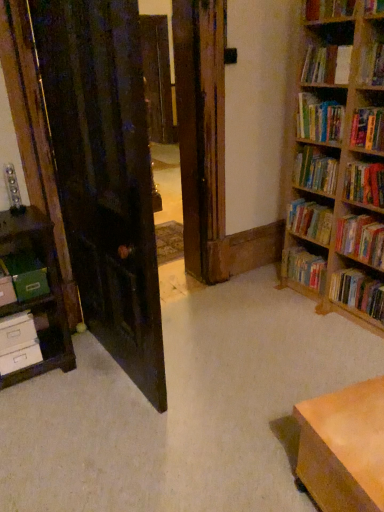
The image size is (384, 512). What do you see at coordinates (105, 175) in the screenshot?
I see `dark wood door at left` at bounding box center [105, 175].

The image size is (384, 512). What do you see at coordinates (327, 65) in the screenshot?
I see `hardcover book at upper right, the 8th book when ordered from bottom to top` at bounding box center [327, 65].

Locate an element on the screen. hardcover books at right, which ranks as the 4th book in bottom-to-top order is located at coordinates 310,221.

Describe the element at coordinates (319, 119) in the screenshot. Image resolution: width=384 pixels, height=512 pixels. I see `hardcover books at upper right, the 3th book in the top-to-bottom sequence` at that location.

Find the location of a particular element. The height and width of the screenshot is (512, 384). white cardboard drawer at lower left, placed as the 1th drawer when sorted from top to bottom is located at coordinates (17, 333).

What do you see at coordinates (328, 9) in the screenshot? I see `hardcover book at upper right, the 1th book when ordered from top to bottom` at bounding box center [328, 9].

Identify the location of white matte drawer at lower left, marked as the first drawer in a bottom-to-top arrangement. (20, 358).

Find the location of a particular element. dark wood door at left is located at coordinates [105, 175].

How much distance is there between hardcover book at lower right, the eighth book when ordered from top to bottom, and hardcover books at upper right, the 3th book in the top-to-bottom sequence?

A distance of 86.17 centimeters exists between hardcover book at lower right, the eighth book when ordered from top to bottom, and hardcover books at upper right, the 3th book in the top-to-bottom sequence.

Considering the sizes of objects hardcover book at lower right, the eighth book when ordered from top to bottom, and hardcover books at upper right, acting as the seventh book starting from the bottom, in the image provided, who is shorter, hardcover book at lower right, the eighth book when ordered from top to bottom, or hardcover books at upper right, acting as the seventh book starting from the bottom,?

With less height is hardcover book at lower right, the eighth book when ordered from top to bottom.

Between hardcover book at lower right, the eighth book when ordered from top to bottom, and hardcover books at upper right, the 3th book in the top-to-bottom sequence, which one appears on the left side from the viewer's perspective?

hardcover books at upper right, the 3th book in the top-to-bottom sequence, is more to the left.

Is hardcover book at lower right, the 2th book ordered from the bottom, not close to hardcover books at upper right, acting as the seventh book starting from the bottom?

hardcover book at lower right, the 2th book ordered from the bottom, is near hardcover books at upper right, acting as the seventh book starting from the bottom, not far away.

Looking at this image, is hardcover books at upper right, the 3th book in the top-to-bottom sequence, positioned with its back to white matte drawer at lower left, the second drawer from the top?

That's not correct — hardcover books at upper right, the 3th book in the top-to-bottom sequence, is not looking away from white matte drawer at lower left, the second drawer from the top.

Considering the positions of objects hardcover books at upper right, acting as the seventh book starting from the bottom, and white matte drawer at lower left, marked as the first drawer in a bottom-to-top arrangement, in the image provided, who is more to the right, hardcover books at upper right, acting as the seventh book starting from the bottom, or white matte drawer at lower left, marked as the first drawer in a bottom-to-top arrangement,?

Positioned to the right is hardcover books at upper right, acting as the seventh book starting from the bottom.

How different are the orientations of hardcover books at upper right, the 3th book in the top-to-bottom sequence, and white matte drawer at lower left, the second drawer from the top, in degrees?

87.4 degrees separate the facing orientations of hardcover books at upper right, the 3th book in the top-to-bottom sequence, and white matte drawer at lower left, the second drawer from the top.

Can you confirm if hardcover books at upper right, the 3th book in the top-to-bottom sequence, is taller than white matte drawer at lower left, marked as the first drawer in a bottom-to-top arrangement?

Yes.

Between hardcover books at upper right, the 4th book positioned from the top, and white matte drawer at lower left, the second drawer from the top, which one has smaller width?

white matte drawer at lower left, the second drawer from the top.

Between hardcover books at upper right, which is the sixth book in bottom-to-top order, and white matte drawer at lower left, marked as the first drawer in a bottom-to-top arrangement, which one has larger size?

Bigger between the two is hardcover books at upper right, which is the sixth book in bottom-to-top order.

From a real-world perspective, which is physically below, hardcover books at upper right, the 4th book positioned from the top, or white matte drawer at lower left, the second drawer from the top?

In real-world perspective, white matte drawer at lower left, the second drawer from the top, is lower.

Is hardcover books at upper right, which is the sixth book in bottom-to-top order, not near white matte drawer at lower left, the second drawer from the top?

Yes.

Between green matte paper at left and white cardboard drawer at lower left, placed as the 1th drawer when sorted from top to bottom, which one has larger width?

Wider between the two is green matte paper at left.

In the scene shown: From a real-world perspective, which is physically below, green matte paper at left or white cardboard drawer at lower left, the second drawer when ordered from bottom to top?

In real-world perspective, white cardboard drawer at lower left, the second drawer when ordered from bottom to top, is lower.

Is green matte paper at left facing away from white cardboard drawer at lower left, placed as the 1th drawer when sorted from top to bottom?

No, green matte paper at left is not facing away from white cardboard drawer at lower left, placed as the 1th drawer when sorted from top to bottom.

How different are the orientations of green matte paper at left and white cardboard drawer at lower left, placed as the 1th drawer when sorted from top to bottom, in degrees?

The facing directions of green matte paper at left and white cardboard drawer at lower left, placed as the 1th drawer when sorted from top to bottom, are 0.0986 degrees apart.

Which of these two, green matte paper at left or hardcover books at upper right, which is the sixth book in bottom-to-top order, is thinner?

hardcover books at upper right, which is the sixth book in bottom-to-top order.

From a real-world perspective, between green matte paper at left and hardcover books at upper right, which is the sixth book in bottom-to-top order, who is vertically higher?

hardcover books at upper right, which is the sixth book in bottom-to-top order.

From the image's perspective, which object appears higher, green matte paper at left or hardcover books at upper right, the 4th book positioned from the top?

hardcover books at upper right, the 4th book positioned from the top, is shown above in the image.

Are green matte paper at left and hardcover books at upper right, the 4th book positioned from the top, beside each other?

No.

Considering the sizes of white matte drawer at lower left, the second drawer from the top, and hardcover book at lower right, the 2th book ordered from the bottom, in the image, is white matte drawer at lower left, the second drawer from the top, wider or thinner than hardcover book at lower right, the 2th book ordered from the bottom,?

Clearly, white matte drawer at lower left, the second drawer from the top, has less width compared to hardcover book at lower right, the 2th book ordered from the bottom.

Which point is more distant from viewer, (21, 352) or (313, 273)?

Point (313, 273)

Is white matte drawer at lower left, the second drawer from the top, aimed at hardcover book at lower right, the eighth book when ordered from top to bottom?

No, white matte drawer at lower left, the second drawer from the top, is not aimed at hardcover book at lower right, the eighth book when ordered from top to bottom.

From the image's perspective, which one is positioned lower, white matte drawer at lower left, marked as the first drawer in a bottom-to-top arrangement, or hardcover book at lower right, the eighth book when ordered from top to bottom?

white matte drawer at lower left, marked as the first drawer in a bottom-to-top arrangement, appears lower in the image.

Could you tell me if hardcover books at upper right, the 4th book positioned from the top, is turned towards wooden table at lower right?

No, hardcover books at upper right, the 4th book positioned from the top, does not turn towards wooden table at lower right.

Can you confirm if hardcover books at upper right, which is the sixth book in bottom-to-top order, is bigger than wooden table at lower right?

Incorrect, hardcover books at upper right, which is the sixth book in bottom-to-top order, is not larger than wooden table at lower right.

Does hardcover books at upper right, which is the sixth book in bottom-to-top order, come in front of wooden table at lower right?

No, it is behind wooden table at lower right.

Where is `the 2nd book counting from the right of the hardcover books at upper right, acting as the seventh book starting from the bottom`? The width and height of the screenshot is (384, 512). the 2nd book counting from the right of the hardcover books at upper right, acting as the seventh book starting from the bottom is located at coordinates (303, 268).

Where is `the 7th book located above the white matte drawer at lower left, marked as the first drawer in a bottom-to-top arrangement (from a real-world perspective)`? the 7th book located above the white matte drawer at lower left, marked as the first drawer in a bottom-to-top arrangement (from a real-world perspective) is located at coordinates (319, 119).

Considering their positions, is hardcover books at upper right, the 3th book in the top-to-bottom sequence, positioned closer to hardcover books at right, which ranks as the 4th book in bottom-to-top order, than hardcover book at right, acting as the third book starting from the bottom?

hardcover book at right, acting as the third book starting from the bottom, is closer to hardcover books at right, which ranks as the 4th book in bottom-to-top order.

Estimate the real-world distances between objects in this image. Which object is further from dark wood door at left, hardcover books at upper right, the 3th book in the top-to-bottom sequence, or hardcover books at right, the sixth book in the top-to-bottom sequence?

hardcover books at right, the sixth book in the top-to-bottom sequence, is positioned further to the anchor dark wood door at left.

Looking at the image, which one is located closer to hardcover books at upper right, which is the sixth book in bottom-to-top order, wooden table at lower right or hardcover book at upper right, arranged as the fifth book when viewed from the top?

Among the two, hardcover book at upper right, arranged as the fifth book when viewed from the top, is located nearer to hardcover books at upper right, which is the sixth book in bottom-to-top order.

Estimate the real-world distances between objects in this image. Which object is further from hardcover book at upper right, arranged as the fifth book when viewed from the top, hardcover books at upper right, acting as the seventh book starting from the bottom, or hardcover book at right, arranged as the ninth book when viewed from the top?

Based on the image, hardcover book at right, arranged as the ninth book when viewed from the top, appears to be further to hardcover book at upper right, arranged as the fifth book when viewed from the top.

Which object lies nearer to the anchor point hardcover book at right, the seventh book positioned from the top, hardcover books at right, which ranks as the 4th book in bottom-to-top order, or white matte drawer at lower left, marked as the first drawer in a bottom-to-top arrangement?

hardcover books at right, which ranks as the 4th book in bottom-to-top order, is positioned closer to the anchor hardcover book at right, the seventh book positioned from the top.

From the image, which object appears to be farther from green matte paper at left, hardcover book at upper right, the 1th book when ordered from top to bottom, or white cardboard drawer at lower left, the second drawer when ordered from bottom to top?

hardcover book at upper right, the 1th book when ordered from top to bottom, is further to green matte paper at left.

When comparing their distances from wooden table at lower right, does hardcover book at upper right, positioned as the second book in top-to-bottom order, or dark wood door at left seem further?

hardcover book at upper right, positioned as the second book in top-to-bottom order.

Estimate the real-world distances between objects in this image. Which object is further from hardcover book at upper right, the 8th book when ordered from bottom to top, hardcover books at upper right, the 3th book in the top-to-bottom sequence, or dark wood door at left?

The object further to hardcover book at upper right, the 8th book when ordered from bottom to top, is dark wood door at left.

Where is `table situated between green matte paper at left and hardcover books at upper right, the 3th book in the top-to-bottom sequence, from left to right`? table situated between green matte paper at left and hardcover books at upper right, the 3th book in the top-to-bottom sequence, from left to right is located at coordinates (343, 448).

Where is `paperback book between white matte drawer at lower left, marked as the first drawer in a bottom-to-top arrangement, and hardcover book at right, the 1th book in the bottom-to-top sequence, from left to right`? Image resolution: width=384 pixels, height=512 pixels. paperback book between white matte drawer at lower left, marked as the first drawer in a bottom-to-top arrangement, and hardcover book at right, the 1th book in the bottom-to-top sequence, from left to right is located at coordinates (26, 275).

At what (x,y) coordinates should I click in order to perform the action: click on door between white cardboard drawer at lower left, the second drawer when ordered from bottom to top, and hardcover book at right, arranged as the ninth book when viewed from the top. Please return your answer as a coordinate pair (x, y). Looking at the image, I should click on (105, 175).

Image resolution: width=384 pixels, height=512 pixels. Identify the location of table between white matte drawer at lower left, the second drawer from the top, and hardcover book at right, the seventh book positioned from the top. (343, 448).